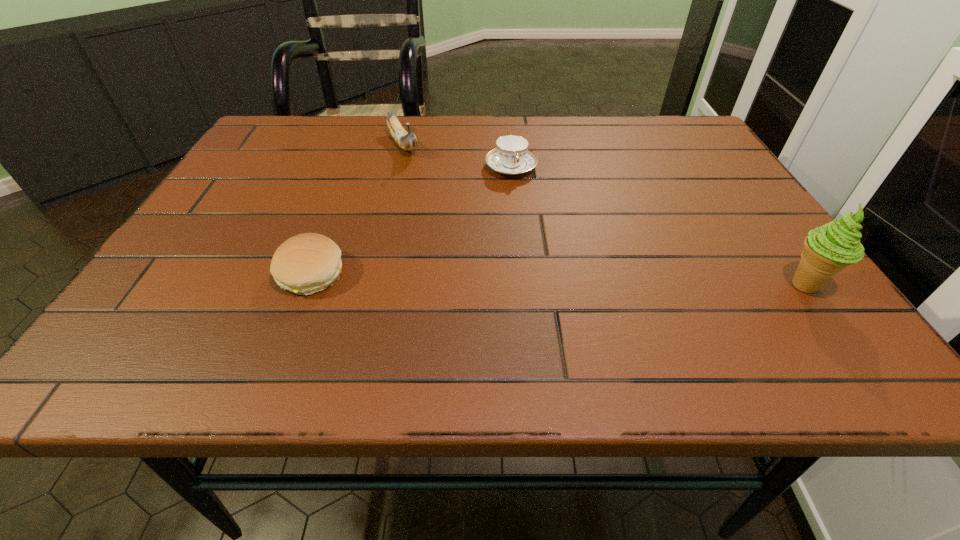
You are a GUI agent. You are given a task and a screenshot of the screen. Output one action in this format:
    pyautogui.click(x=<x>, y=<y>)
    Task: Click on the leftmost object
    This screenshot has width=960, height=540.
    Given the screenshot: What is the action you would take?
    pyautogui.click(x=304, y=264)

What are the coordinates of `icecream` in the screenshot? It's located at (829, 249).

At what (x,y) coordinates should I click in order to perform the action: click on the tallest object. Please return your answer as a coordinate pair (x, y). This screenshot has width=960, height=540. Looking at the image, I should click on (829, 249).

What are the coordinates of `the third object from right to left` in the screenshot? It's located at (406, 140).

The width and height of the screenshot is (960, 540). Find the location of `the third shortest object`. the third shortest object is located at coordinates (406, 140).

At what (x,y) coordinates should I click in order to perform the action: click on teacup. Please return your answer as a coordinate pair (x, y). Image resolution: width=960 pixels, height=540 pixels. Looking at the image, I should click on (511, 156).

Find the location of a particular element. The width and height of the screenshot is (960, 540). free space located 0.250m on the right of the leftmost object is located at coordinates (481, 274).

Identify the location of vacant area located 0.220m on the left of the tallest object. (659, 286).

Find the location of `vacant area situated 0.100m at the stem of the second object from left to right`. vacant area situated 0.100m at the stem of the second object from left to right is located at coordinates (422, 181).

Locate an element on the screen. free region located at the stem of the second object from left to right is located at coordinates (475, 258).